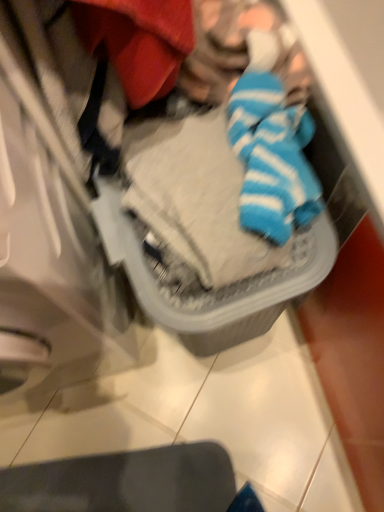
Describe the element at coordinates (164, 197) in the screenshot. This screenshot has width=384, height=512. I see `white fabric baby carriage at center` at that location.

Locate an element on the screen. The image size is (384, 512). white fabric baby carriage at center is located at coordinates (164, 197).

Where is `white fabric baby carriage at center`? The image size is (384, 512). white fabric baby carriage at center is located at coordinates (164, 197).